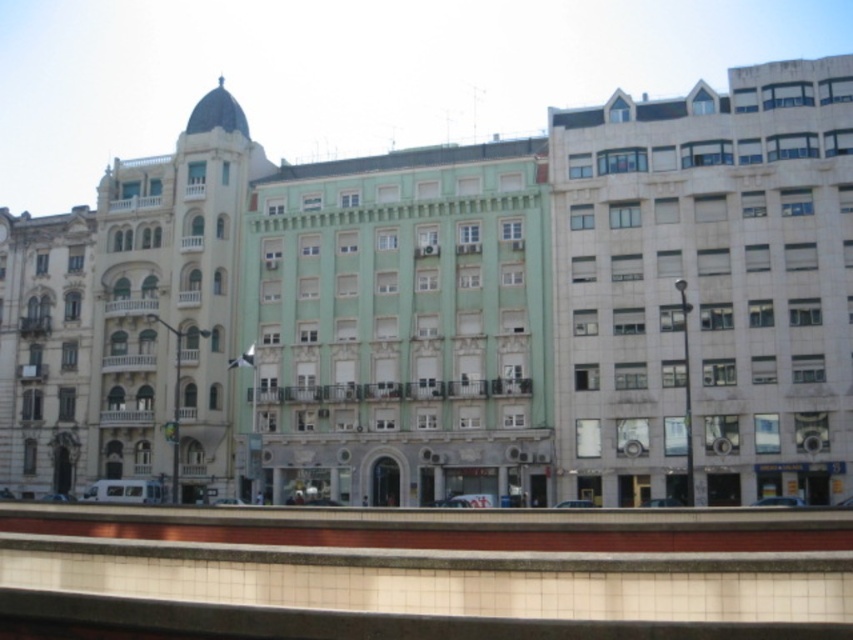
Is white marble building at right shorter than matte gray building at left?

Incorrect, white marble building at right's height does not fall short of matte gray building at left's.

Between white marble building at right and matte gray building at left, which one is positioned lower?

matte gray building at left is below.

From the picture: Measure the distance between point (611,468) and camera.

Point (611,468) and camera are 64.36 meters apart from each other.

Locate an element on the screen. The width and height of the screenshot is (853, 640). white marble building at right is located at coordinates (706, 289).

Can you confirm if green stone building at center is positioned below green matte building at center?

No.

In the scene shown: Between green stone building at center and green matte building at center, which one is positioned lower?

green matte building at center is below.

I want to click on green stone building at center, so click(456, 310).

Between point (524, 317) and point (108, 314), which one is positioned behind?

Positioned behind is point (108, 314).

Does green matte building at center have a greater height compared to beige stone building at left?

No.

Find the location of a particular element. The height and width of the screenshot is (640, 853). green matte building at center is located at coordinates click(399, 326).